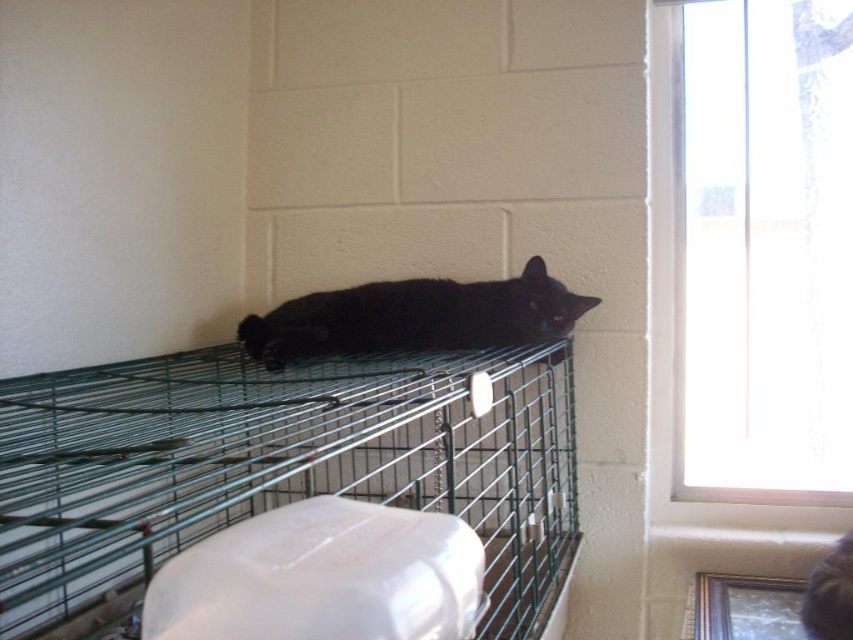
Looking at this image, between green wire cage at upper center and black matte fur cat at center, which one has less height?

With less height is black matte fur cat at center.

Can you confirm if green wire cage at upper center is taller than black matte fur cat at center?

Yes.

Identify the location of green wire cage at upper center. (276, 468).